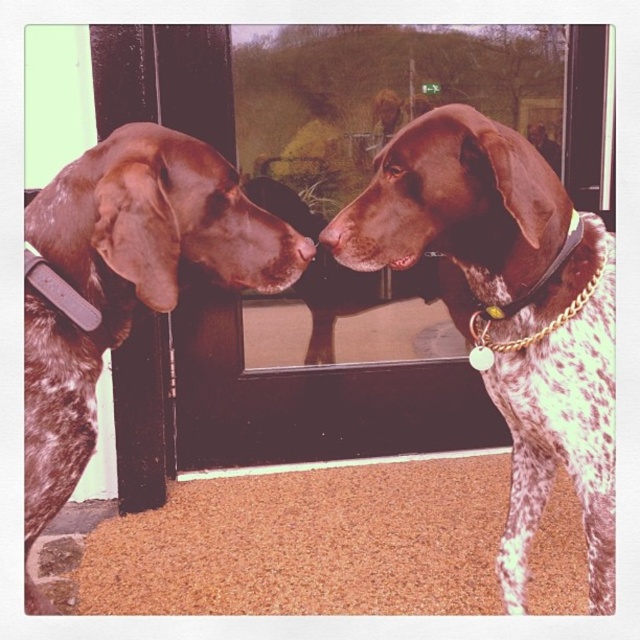
You are a dog owner trying to decide if your dog can comfortably pass through the space between the speckled fur dog at center and the transparent glass window at center. The dog is 60 centimeters wide. Can it fit through the space?

The space between the speckled fur dog at center and the transparent glass window at center is 66.84 centimeters. Since the dog is 60 centimeters wide, it can comfortably fit through the space as the width is sufficient.

You are a dog trainer observing two dogs in a training session. You see a speckled fur dog at center and a brown speckled dog at center. Which dog is positioned to the right of the other?

The speckled fur dog at center is positioned on the right side of brown speckled dog at center.

You are a dog breeder assessing two German Shorthaired Pointers in the image. You need to determine which dog has a more slender build. Both are labeled as speckled fur dog at center and brown speckled dog at center. Which one is thinner?

The speckled fur dog at center is thinner than the brown speckled dog at center.